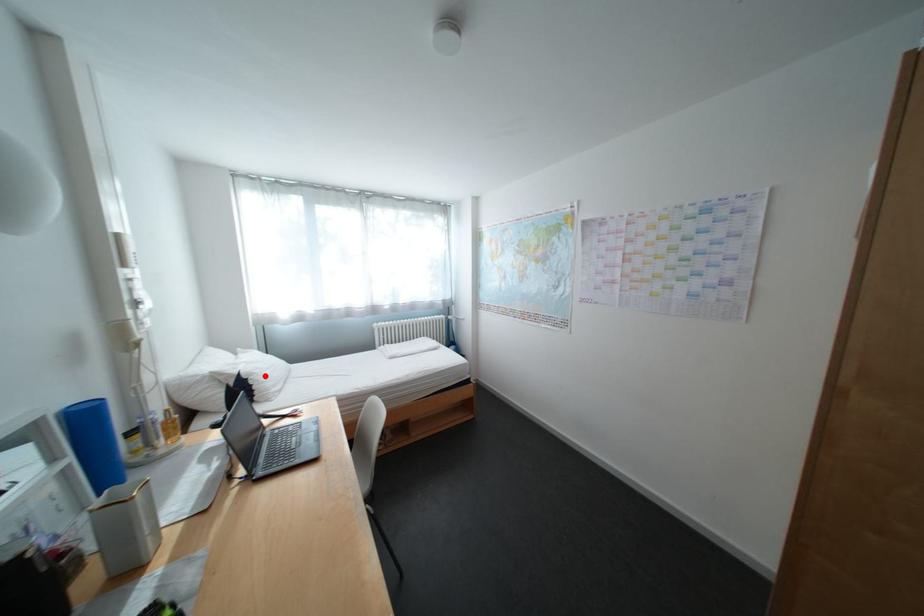
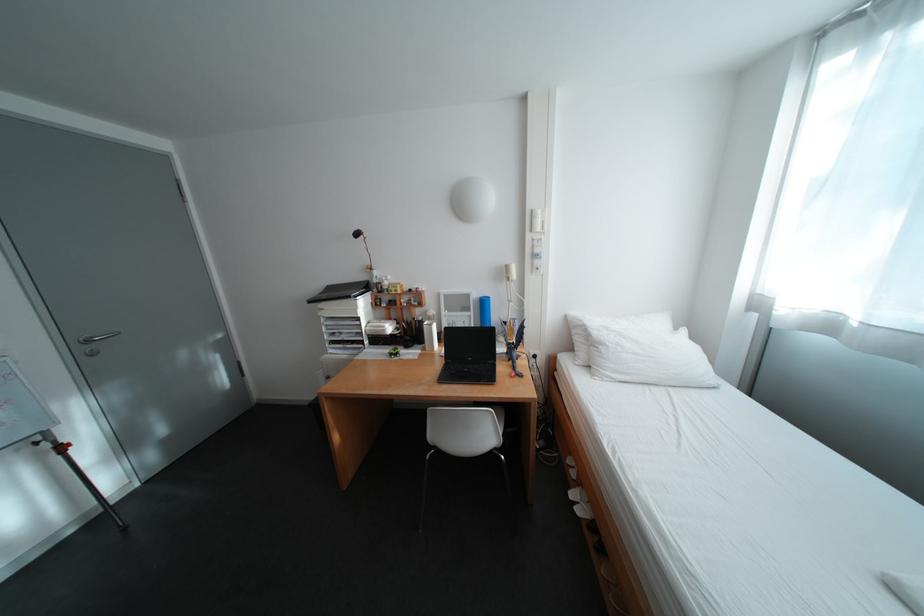
Question: I am providing you with two images of the same scene from different viewpoints. Image1 has a red point marked. In image2, the corresponding 3D location appears at what relative position? Reply with the corresponding letter.

Choices:
 (A) Closer
 (B) Farther

Answer: (B)